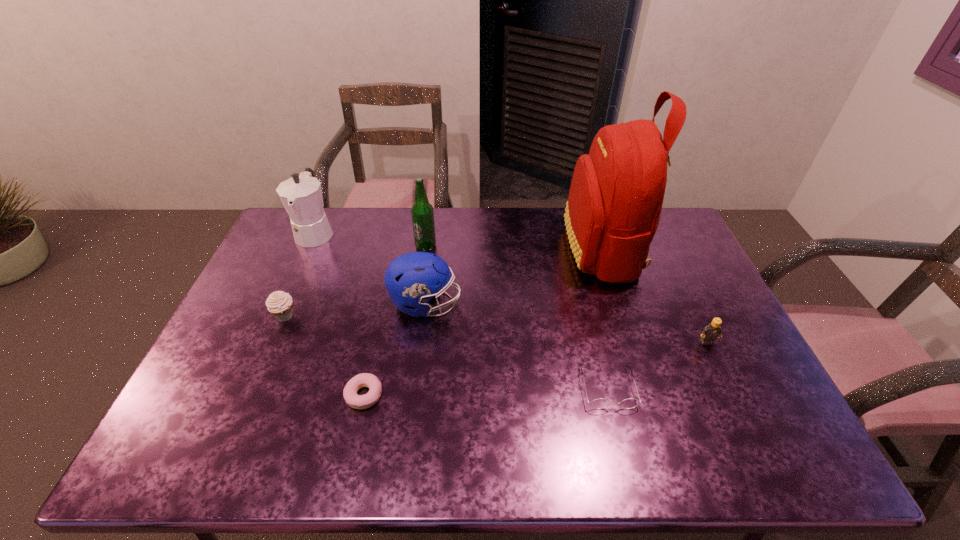
I want to click on object that is the fourth closest one to the muffin, so click(422, 213).

Identify the location of object identified as the closest to the muffin. The image size is (960, 540). (301, 195).

I want to click on vacant region that satisfies the following two spatial constraints: 1. on the front-facing side of the backpack; 2. on the front-facing side of the spectacles, so click(x=646, y=388).